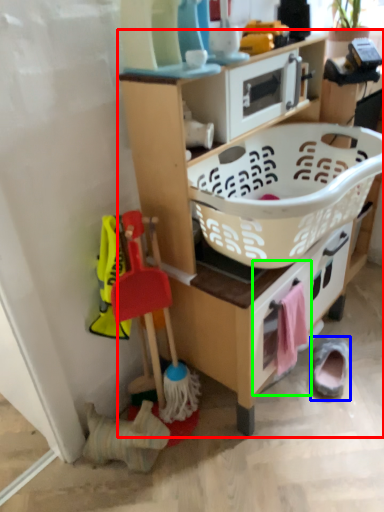
Question: Which object is the closest to the shelf (highlighted by a red box)? Choose among these: footwear (highlighted by a blue box) or drawer (highlighted by a green box).

Choices:
 (A) footwear
 (B) drawer

Answer: (B)